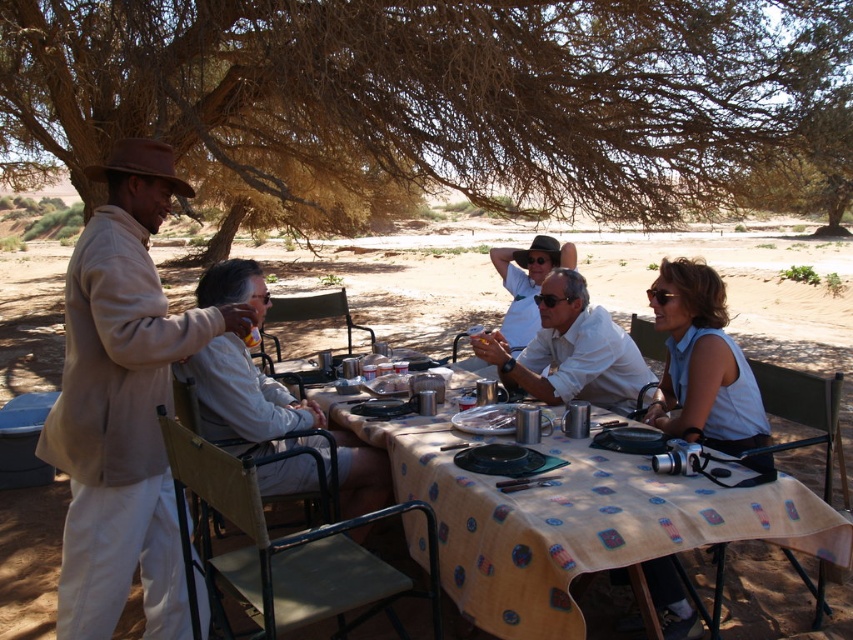
Which of these two, beige cotton shirt at left or matte white shirt at center, stands taller?

beige cotton shirt at left

Can you confirm if beige cotton shirt at left is positioned to the right of matte white shirt at center?

No, beige cotton shirt at left is not to the right of matte white shirt at center.

Does point (155, 596) come behind point (531, 284)?

No, (155, 596) is in front of (531, 284).

At what (x,y) coordinates should I click in order to perform the action: click on beige cotton shirt at left. Please return your answer as a coordinate pair (x, y). Looking at the image, I should click on (123, 404).

Does white fabric shirt at lower right have a larger size compared to white matte shirt at center?

Yes.

Find the location of `white fabric shirt at lower right`. white fabric shirt at lower right is located at coordinates (701, 364).

Consider the image. Who is shorter, light beige fabric chair at center or matte white shirt at center?

With less height is matte white shirt at center.

Does point (225, 390) come behind point (511, 330)?

No, (225, 390) is closer to viewer.

Who is more forward, (262, 417) or (552, 248)?

Point (262, 417) is in front.

Locate an element on the screen. This screenshot has height=640, width=853. light beige fabric chair at center is located at coordinates (244, 397).